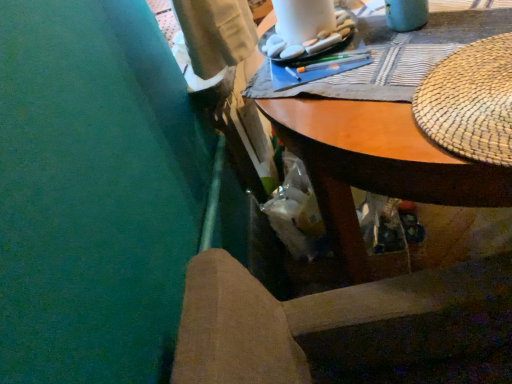
Question: Is woven straw placemat at upper right further to camera compared to white matte rocks at upper center?

Choices:
 (A) no
 (B) yes

Answer: (A)

Question: Considering the relative sizes of woven straw placemat at upper right and white matte rocks at upper center in the image provided, is woven straw placemat at upper right shorter than white matte rocks at upper center?

Choices:
 (A) no
 (B) yes

Answer: (B)

Question: Can you confirm if woven straw placemat at upper right is bigger than white matte rocks at upper center?

Choices:
 (A) no
 (B) yes

Answer: (A)

Question: Is woven straw placemat at upper right with white matte rocks at upper center?

Choices:
 (A) yes
 (B) no

Answer: (B)

Question: Does woven straw placemat at upper right come in front of white matte rocks at upper center?

Choices:
 (A) no
 (B) yes

Answer: (B)

Question: Is woven straw placemat at upper right at the right side of white matte rocks at upper center?

Choices:
 (A) no
 (B) yes

Answer: (B)

Question: From a real-world perspective, is wooden desk at upper center below wooden chair at lower center?

Choices:
 (A) no
 (B) yes

Answer: (B)

Question: Considering the relative positions of wooden desk at upper center and wooden chair at lower center in the image provided, is wooden desk at upper center to the left of wooden chair at lower center from the viewer's perspective?

Choices:
 (A) no
 (B) yes

Answer: (A)

Question: Can you confirm if wooden desk at upper center is wider than wooden chair at lower center?

Choices:
 (A) yes
 (B) no

Answer: (A)

Question: Can you confirm if wooden desk at upper center is bigger than wooden chair at lower center?

Choices:
 (A) yes
 (B) no

Answer: (A)

Question: From a real-world perspective, is wooden desk at upper center on top of wooden chair at lower center?

Choices:
 (A) yes
 (B) no

Answer: (B)

Question: Does wooden desk at upper center have a greater height compared to wooden chair at lower center?

Choices:
 (A) no
 (B) yes

Answer: (B)

Question: Is woven straw placemat at upper right looking in the opposite direction of wooden desk at upper center?

Choices:
 (A) yes
 (B) no

Answer: (A)